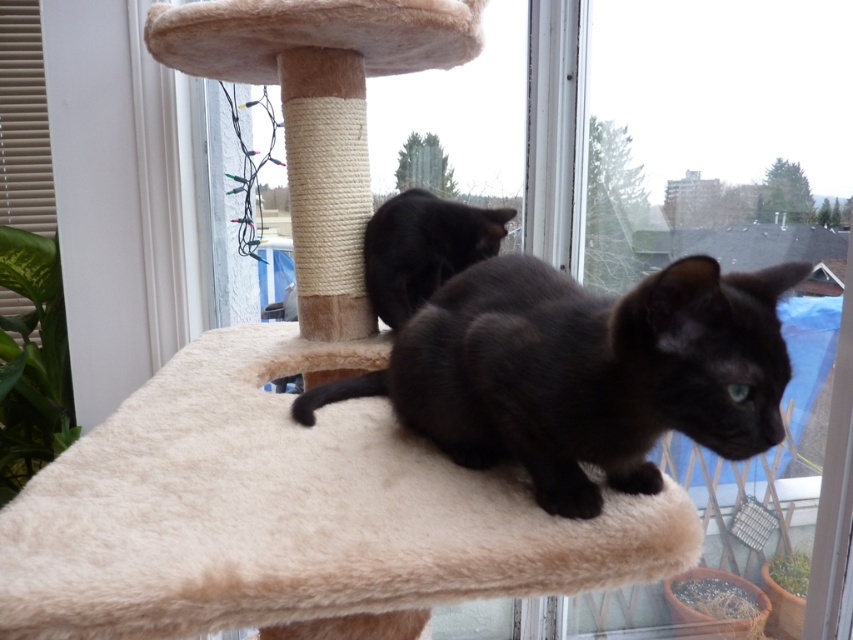
Measure the distance between point (x=613, y=339) and camera.

They are 27.48 inches apart.

Does shiny black cat at center have a greater width compared to black matte cat at center?

Yes.

Identify the location of shiny black cat at center. This screenshot has height=640, width=853. (585, 371).

Does beige plush cat bed at center have a smaller size compared to shiny black cat at center?

Incorrect, beige plush cat bed at center is not smaller in size than shiny black cat at center.

Does beige plush cat bed at center have a greater height compared to shiny black cat at center?

Correct, beige plush cat bed at center is much taller as shiny black cat at center.

Who is more forward, (126,488) or (714,300)?

Point (714,300) is in front.

The image size is (853, 640). I want to click on beige plush cat bed at center, so click(x=291, y=509).

Who is taller, beige plush cat bed at center or black matte cat at center?

Answer: beige plush cat bed at center

Between point (131, 556) and point (439, 202), which one is positioned behind?

Positioned behind is point (439, 202).

Who is more forward, (450, 484) or (392, 257)?

Point (450, 484) is in front.

This screenshot has width=853, height=640. Identify the location of beige plush cat bed at center. (291, 509).